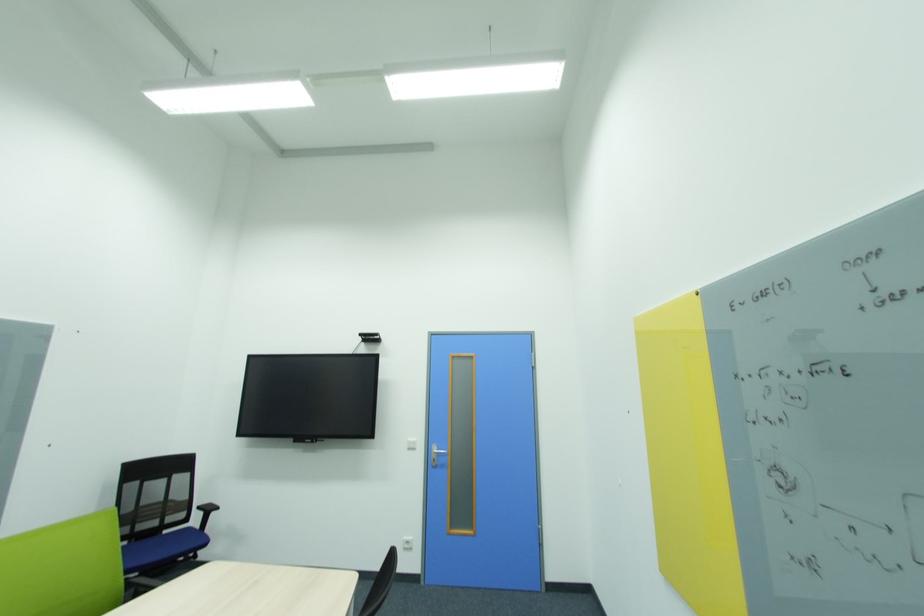
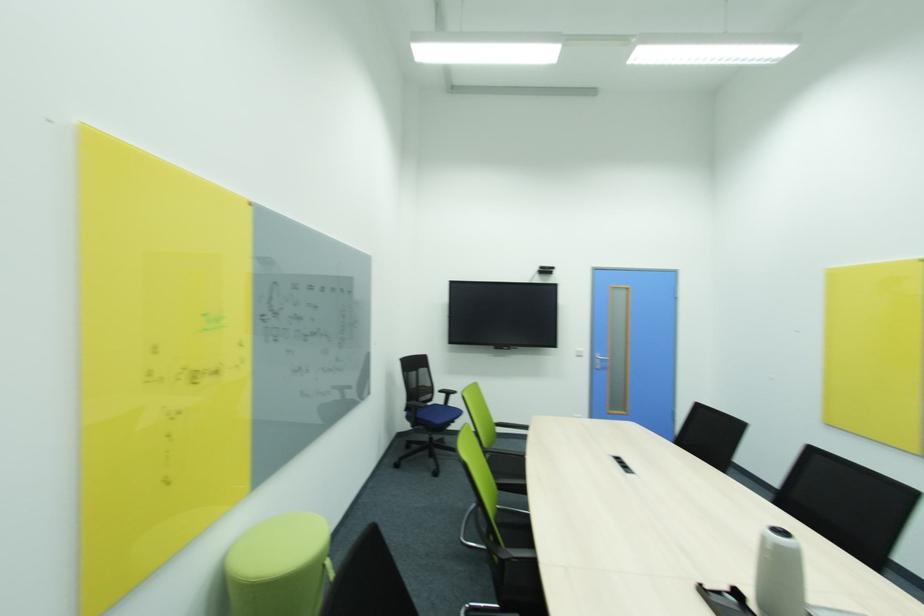
Find the pixel in the second image that matches point (185, 479) in the first image.

(428, 371)